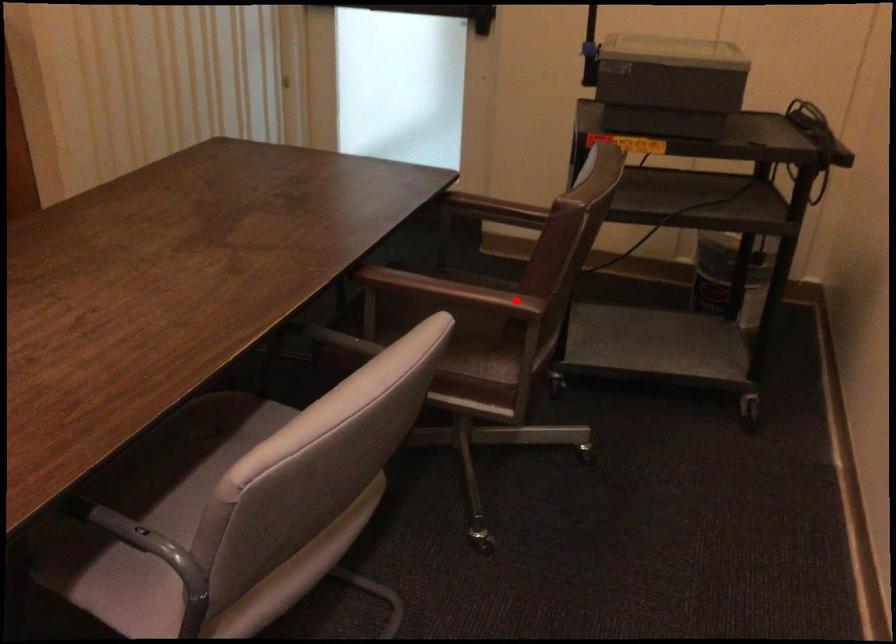
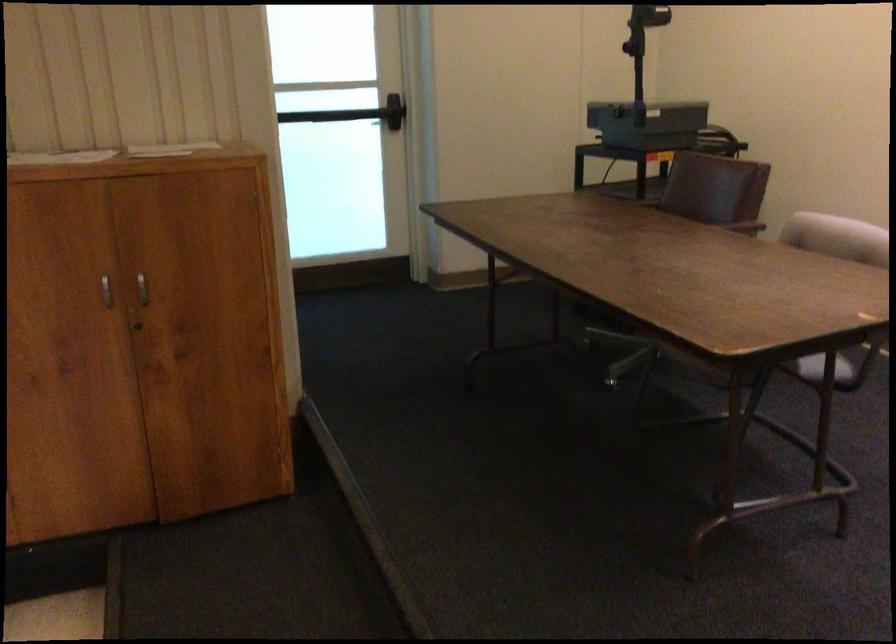
Question: I am providing you with two images of the same scene from different viewpoints. In image1, a red point is highlighted. Considering the same 3D point in image2, which of the following is correct?

Choices:
 (A) It is closer
 (B) It is farther

Answer: (B)